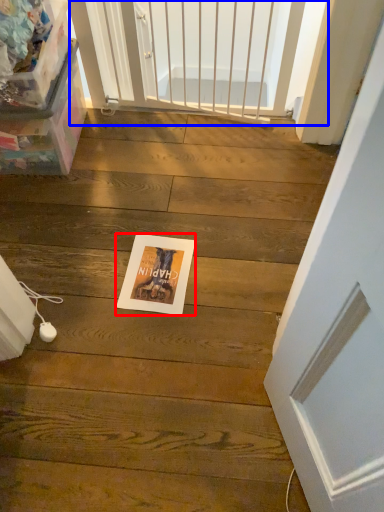
Question: Which of the following is the closest to the observer, postcard (highlighted by a red box) or screen door (highlighted by a blue box)?

Choices:
 (A) postcard
 (B) screen door

Answer: (A)